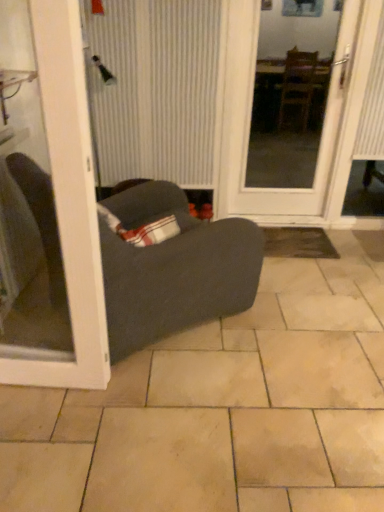
Find the location of a particular element. The width and height of the screenshot is (384, 512). empty space that is ontop of beige ceramic tile at center is located at coordinates pos(227,368).